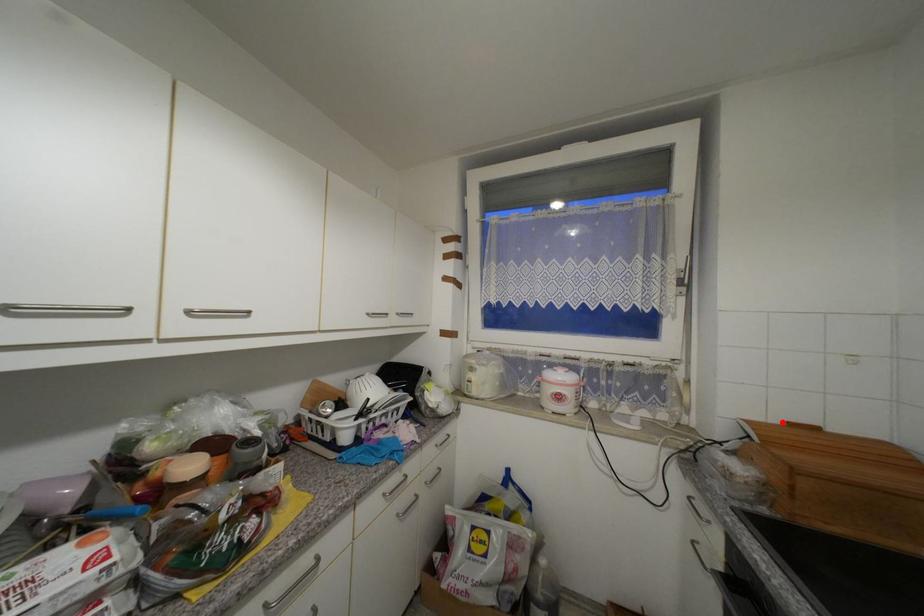
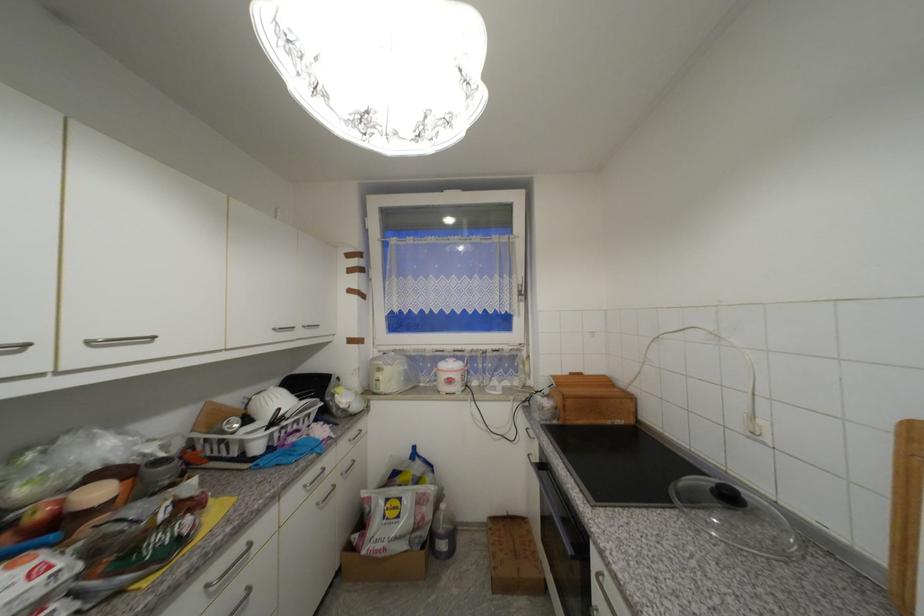
Find the pixel in the second image that matches the highlighted location in the first image.

(572, 374)